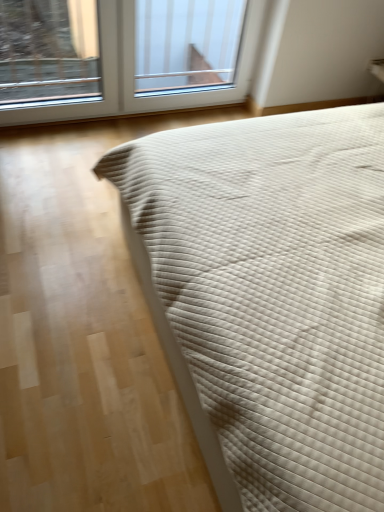
What is the approximate width of white quilted fabric at center?

white quilted fabric at center is 8.58 feet wide.

Locate an element on the screen. The height and width of the screenshot is (512, 384). white quilted fabric at center is located at coordinates (269, 297).

What do you see at coordinates (269, 297) in the screenshot?
I see `white quilted fabric at center` at bounding box center [269, 297].

Where is `white quilted fabric at center`? The width and height of the screenshot is (384, 512). white quilted fabric at center is located at coordinates (269, 297).